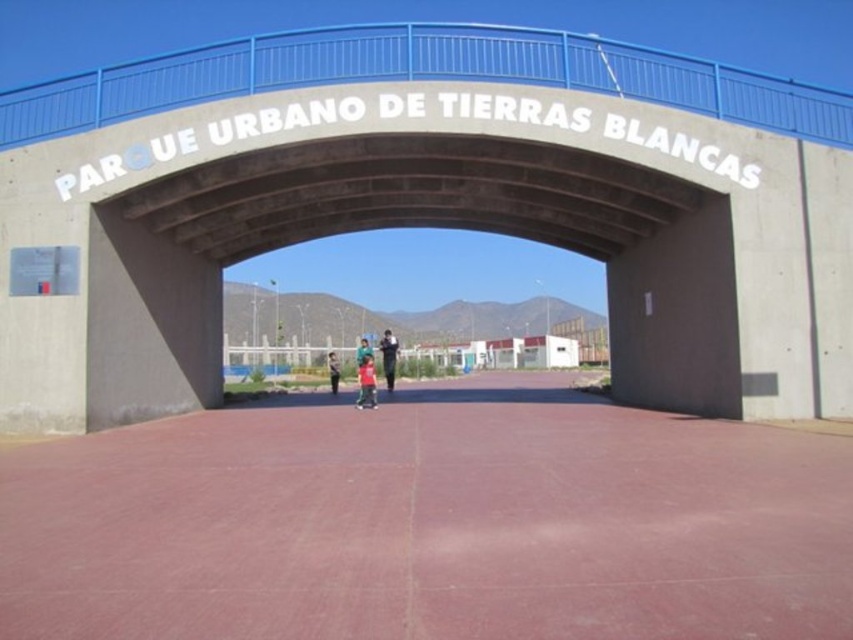
The image size is (853, 640). I want to click on concrete bridge at center, so click(x=424, y=208).

Which is behind, point (654, 339) or point (389, 337)?

Point (389, 337)

Where is `concrete bridge at center`? The image size is (853, 640). concrete bridge at center is located at coordinates (424, 208).

Is concrete bridge at center below light brown leather jacket at center?

Incorrect, concrete bridge at center is not positioned below light brown leather jacket at center.

Is concrete bridge at center bigger than light brown leather jacket at center?

Correct, concrete bridge at center is larger in size than light brown leather jacket at center.

Where is `concrete bridge at center`? This screenshot has width=853, height=640. concrete bridge at center is located at coordinates (424, 208).

Does dark blue jeans at center have a greater height compared to light brown leather jacket at center?

Correct, dark blue jeans at center is much taller as light brown leather jacket at center.

Does dark blue jeans at center appear over light brown leather jacket at center?

Indeed, dark blue jeans at center is positioned over light brown leather jacket at center.

Describe the element at coordinates (387, 356) in the screenshot. I see `dark blue jeans at center` at that location.

The width and height of the screenshot is (853, 640). Find the location of `dark blue jeans at center`. dark blue jeans at center is located at coordinates (387, 356).